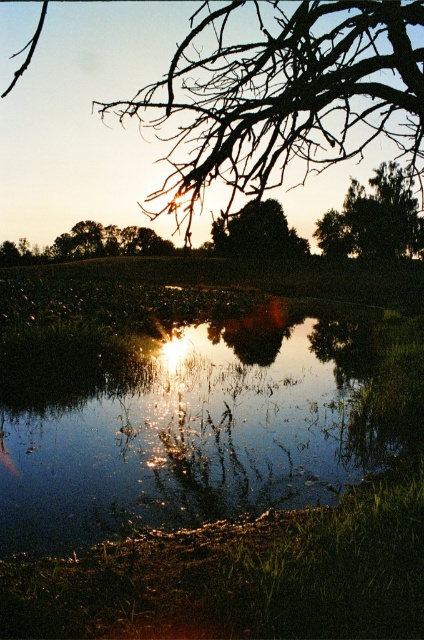
Is reflective glass water at center taller than green matte tree at upper right?

In fact, reflective glass water at center may be shorter than green matte tree at upper right.

Does reflective glass water at center come behind green matte tree at upper right?

No, it is not.

Which is behind, point (141, 368) or point (359, 237)?

Point (359, 237)

This screenshot has height=640, width=424. I want to click on reflective glass water at center, so pyautogui.click(x=183, y=419).

Which is below, brown/dry wood branches at upper center or green matte tree at upper right?

Positioned lower is brown/dry wood branches at upper center.

Is brown/dry wood branches at upper center below green matte tree at upper right?

Yes, brown/dry wood branches at upper center is below green matte tree at upper right.

Describe the element at coordinates (278, 99) in the screenshot. I see `brown/dry wood branches at upper center` at that location.

This screenshot has height=640, width=424. I want to click on brown/dry wood branches at upper center, so click(278, 99).

Who is shorter, reflective glass water at center or green matte tree at center?

With less height is reflective glass water at center.

Is reflective glass water at center taller than green matte tree at center?

No.

Looking at this image, who is more forward, (321, 433) or (270, 214)?

Positioned in front is point (321, 433).

This screenshot has height=640, width=424. Find the location of `reflective glass water at center`. reflective glass water at center is located at coordinates (183, 419).